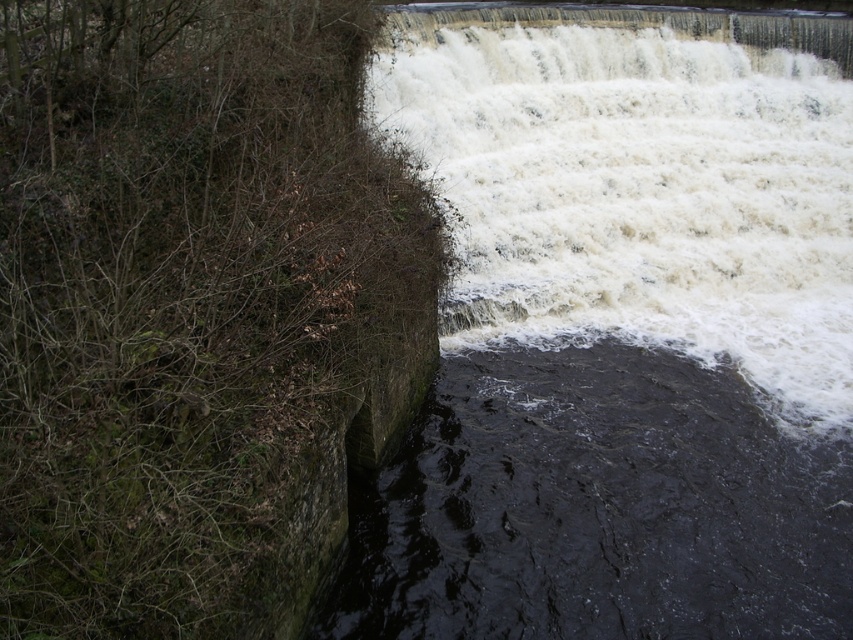
You are standing at the base of the waterfall and want to cross to the other side. Which object, the white frothy water at upper right or the dark stone river at lower left, would you consider safer to walk on?

The dark stone river at lower left would be safer to walk on because the white frothy water at upper right has a greater height, indicating it is deeper and more turbulent, making it dangerous for walking.